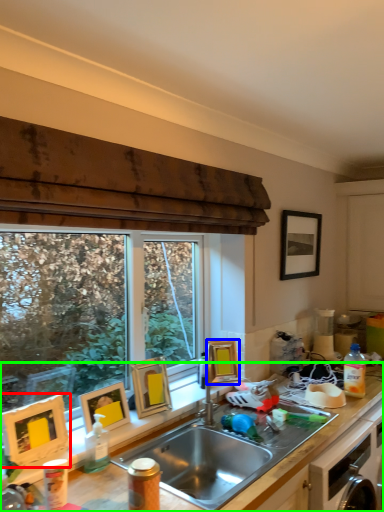
Question: Which object is positioned closest to picture frame (highlighted by a red box)? Select from picture frame (highlighted by a blue box) and cabinetry (highlighted by a green box).

Choices:
 (A) picture frame
 (B) cabinetry

Answer: (B)